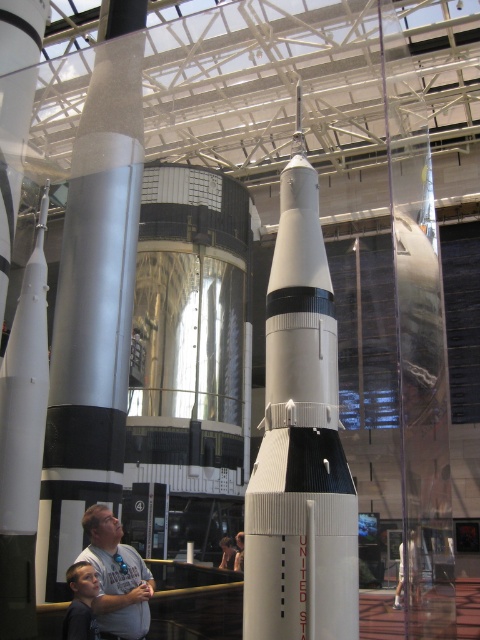
You are a security guard in the aerospace museum. You notice two items in the exhibit area that shouldn not be there. The gray fabric shirt at lower center and the light brown leather jacket at center. You need to report their positions and which one is taller. What do you observe?

The gray fabric shirt at lower center is taller than the light brown leather jacket at center.

From the picture: You are an event organizer planning a guided tour in the aerospace museum. You need to ensure that the path between the light blue shirt at lower left and the light brown leather jacket at center is accessible for visitors. Based on the scene description, is the path between them clear?

The light blue shirt at lower left is to the left of light brown leather jacket at center, so the path between them is clear as there are no objects blocking the space between them according to the scene description.